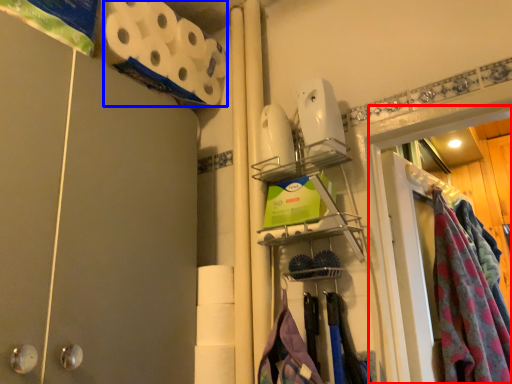
Question: Which object appears farthest to the camera in this image, glass door (highlighted by a red box) or toilet paper (highlighted by a blue box)?

Choices:
 (A) glass door
 (B) toilet paper

Answer: (B)